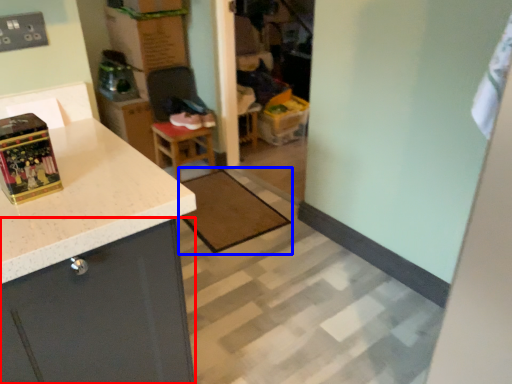
Question: Which object is further to the camera taking this photo, cabinetry (highlighted by a red box) or mat (highlighted by a blue box)?

Choices:
 (A) cabinetry
 (B) mat

Answer: (B)